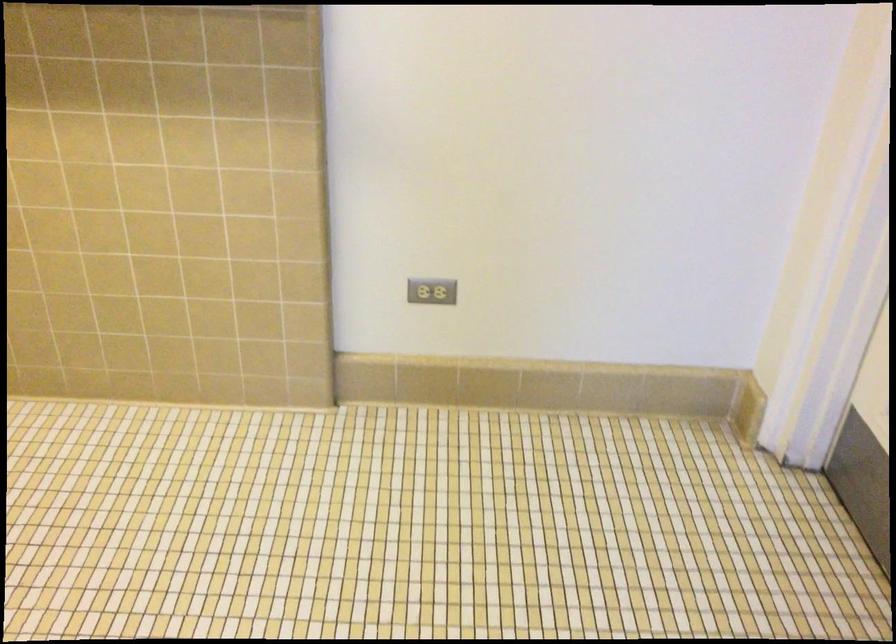
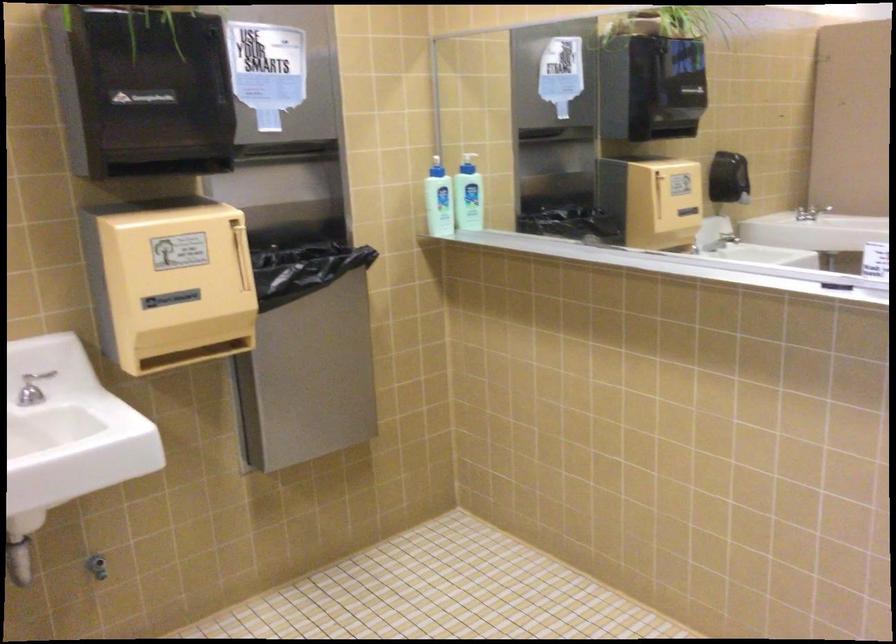
Question: Based on the continuous images, in which direction is the camera rotating? Reply with the corresponding letter.

Choices:
 (A) Left
 (B) Right
 (C) Up
 (D) Down

Answer: (A)